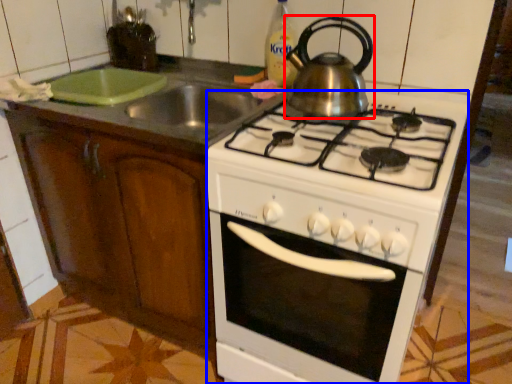
Question: Which object is further to the camera taking this photo, kitchen appliance (highlighted by a red box) or oven (highlighted by a blue box)?

Choices:
 (A) kitchen appliance
 (B) oven

Answer: (A)